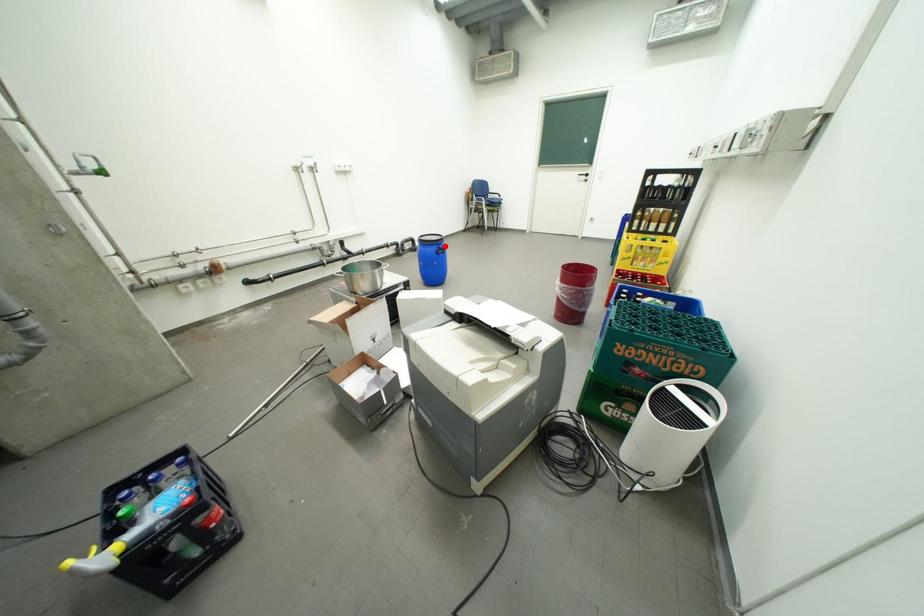
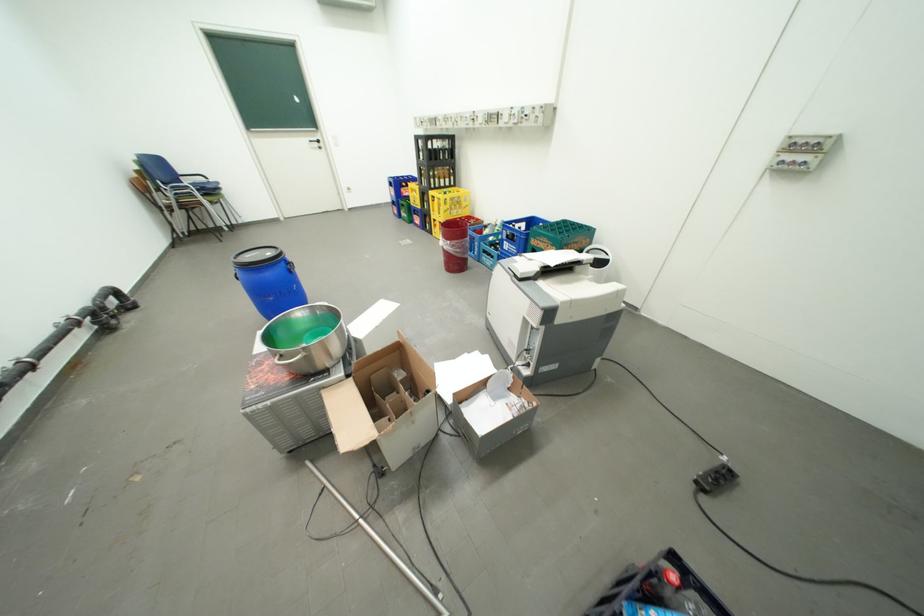
In the second image, find the point that corresponds to the highlighted location in the first image.

(290, 262)